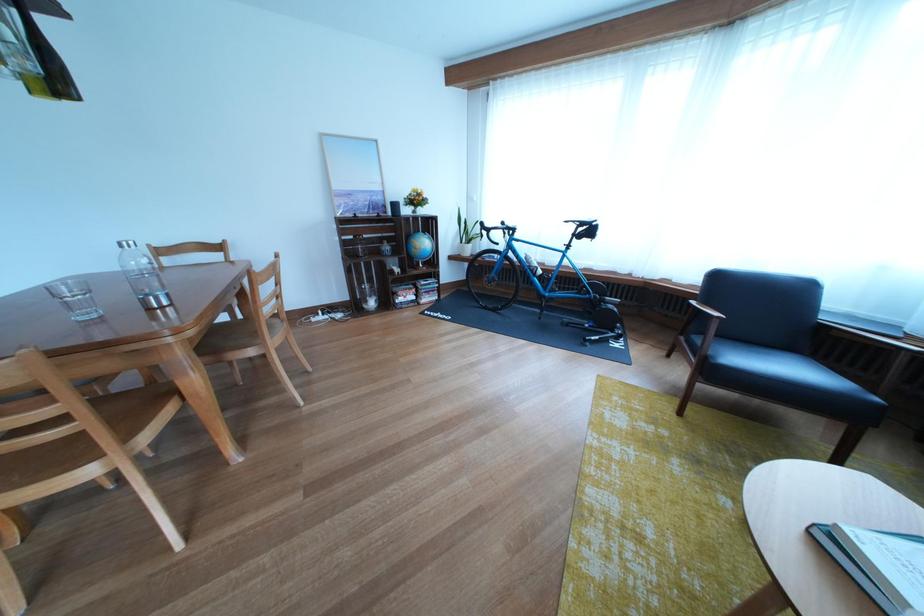
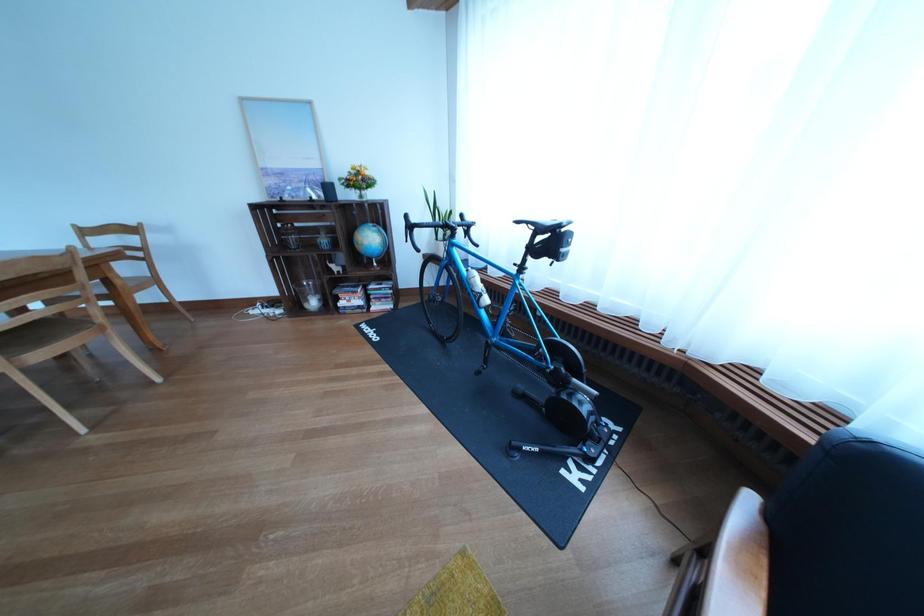
Find the pixel in the second image that matches the point at 588,228 in the first image.

(541, 229)